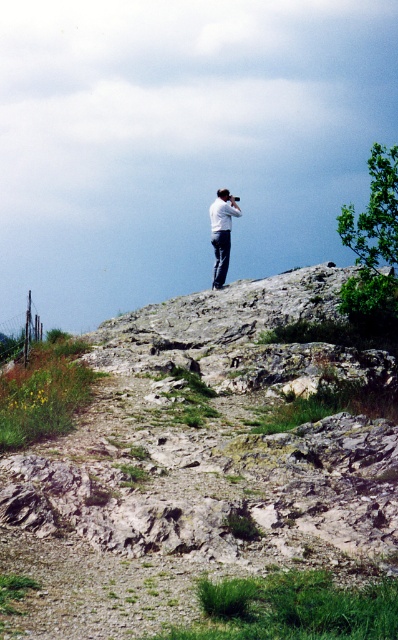
You are planning to place a small flag exactly between the gray rocky hillside at upper center and the white fabric camera at upper center. Which object will the flag be closer to?

The flag will be closer to the white fabric camera at upper center because the gray rocky hillside at upper center is wider than the white fabric camera at upper center, so the midpoint between them would be nearer to the smaller object.

You are a hiker who wants to take a photo of the gray rocky hillside at upper center using the white fabric camera at upper center. Since the camera is positioned behind the hillside, will you be able to take a clear photo of the hillside without any obstruction?

The gray rocky hillside at upper center is closer to the viewer than the white fabric camera at upper center. This means the camera is behind the hillside, so the hillside would block the view, making it impossible to take a clear photo of it through the camera.